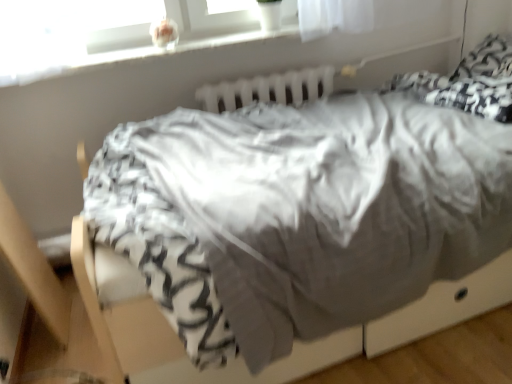
The width and height of the screenshot is (512, 384). Describe the element at coordinates (138, 52) in the screenshot. I see `white plastic window sill at upper center` at that location.

Locate an element on the screen. The height and width of the screenshot is (384, 512). white plastic window sill at upper center is located at coordinates (138, 52).

Where is `white plastic radiator at upper center`? white plastic radiator at upper center is located at coordinates (268, 89).

The width and height of the screenshot is (512, 384). What do you see at coordinates (268, 89) in the screenshot? I see `white plastic radiator at upper center` at bounding box center [268, 89].

In order to face white plastic radiator at upper center, should I rotate leftwards or rightwards?

It's best to rotate right around 1.403 degrees.

Measure the distance between point (x=332, y=86) and camera.

A distance of 2.09 meters exists between point (x=332, y=86) and camera.

Image resolution: width=512 pixels, height=384 pixels. In order to click on white plastic window sill at upper center in this screenshot , I will do `click(138, 52)`.

Visually, is white plastic window sill at upper center positioned to the left or to the right of white plastic radiator at upper center?

From the image, it's evident that white plastic window sill at upper center is to the left of white plastic radiator at upper center.

Which object is closer to the camera, white plastic window sill at upper center or white plastic radiator at upper center?

Positioned in front is white plastic window sill at upper center.

Is point (12, 83) farther from camera compared to point (306, 98)?

No, (12, 83) is in front of (306, 98).

Looking at this image, from the image's perspective, is white plastic window sill at upper center below white plastic radiator at upper center?

No, from the image's perspective, white plastic window sill at upper center is not beneath white plastic radiator at upper center.

From a real-world perspective, which is physically below, white plastic window sill at upper center or white plastic radiator at upper center?

In real-world perspective, white plastic radiator at upper center is lower.

Considering the relative sizes of white plastic window sill at upper center and white plastic radiator at upper center in the image provided, is white plastic window sill at upper center wider than white plastic radiator at upper center?

Yes, white plastic window sill at upper center is wider than white plastic radiator at upper center.

Is white plastic window sill at upper center taller than white plastic radiator at upper center?

In fact, white plastic window sill at upper center may be shorter than white plastic radiator at upper center.

Can you confirm if white plastic window sill at upper center is smaller than white plastic radiator at upper center?

No.

Choose the correct answer: Is white plastic window sill at upper center inside white plastic radiator at upper center or outside it?

white plastic window sill at upper center is not inside white plastic radiator at upper center, it's outside.

Does white plastic window sill at upper center touch white plastic radiator at upper center?

white plastic window sill at upper center and white plastic radiator at upper center are not in contact.

Is white plastic window sill at upper center facing towards white plastic radiator at upper center?

No, white plastic window sill at upper center is not turned towards white plastic radiator at upper center.

Locate an element on the screen. The image size is (512, 384). radiator on the right of white plastic window sill at upper center is located at coordinates (268, 89).

Considering the positions of objects white plastic radiator at upper center and white plastic window sill at upper center in the image provided, who is more to the left, white plastic radiator at upper center or white plastic window sill at upper center?

white plastic window sill at upper center.

Which object is closer to the camera, white plastic radiator at upper center or white plastic window sill at upper center?

white plastic window sill at upper center is more forward.

Considering the points (282, 89) and (263, 36), which point is behind, point (282, 89) or point (263, 36)?

The point (282, 89) is farther from the camera.

From the image's perspective, is white plastic radiator at upper center under white plastic window sill at upper center?

Yes, from the image's perspective, white plastic radiator at upper center is beneath white plastic window sill at upper center.

From a real-world perspective, which is physically above, white plastic radiator at upper center or white plastic window sill at upper center?

white plastic window sill at upper center.

In terms of width, does white plastic radiator at upper center look wider or thinner when compared to white plastic window sill at upper center?

white plastic radiator at upper center is thinner than white plastic window sill at upper center.

Which of these two, white plastic radiator at upper center or white plastic window sill at upper center, stands shorter?

white plastic window sill at upper center is shorter.

Considering the sizes of white plastic radiator at upper center and white plastic window sill at upper center in the image, is white plastic radiator at upper center bigger or smaller than white plastic window sill at upper center?

Considering their sizes, white plastic radiator at upper center takes up less space than white plastic window sill at upper center.

Is white plastic radiator at upper center completely or partially outside of white plastic window sill at upper center?

white plastic radiator at upper center is positioned outside white plastic window sill at upper center.

Is white plastic radiator at upper center directly adjacent to white plastic window sill at upper center?

No, white plastic radiator at upper center is not next to white plastic window sill at upper center.

Is white plastic radiator at upper center oriented away from white plastic window sill at upper center?

white plastic radiator at upper center does not have its back to white plastic window sill at upper center.

How different are the orientations of white plastic radiator at upper center and white plastic window sill at upper center in degrees?

The facing directions of white plastic radiator at upper center and white plastic window sill at upper center are 1.25 degrees apart.

This screenshot has height=384, width=512. I want to click on window sill in front of the white plastic radiator at upper center, so click(138, 52).

Find the location of a particular element. radiator lying behind the white plastic window sill at upper center is located at coordinates (268, 89).

Where is `radiator below the white plastic window sill at upper center (from a real-world perspective)`? Image resolution: width=512 pixels, height=384 pixels. radiator below the white plastic window sill at upper center (from a real-world perspective) is located at coordinates (268, 89).